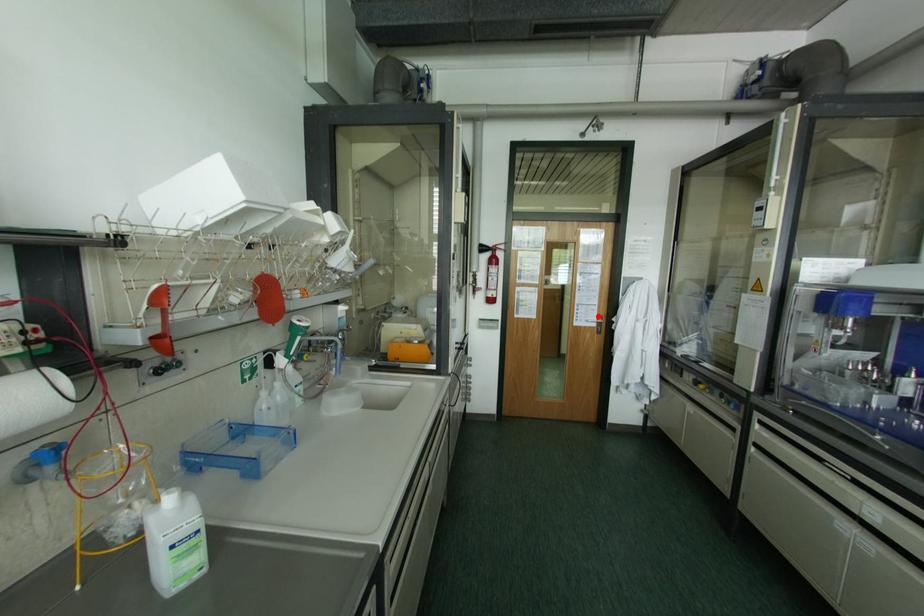
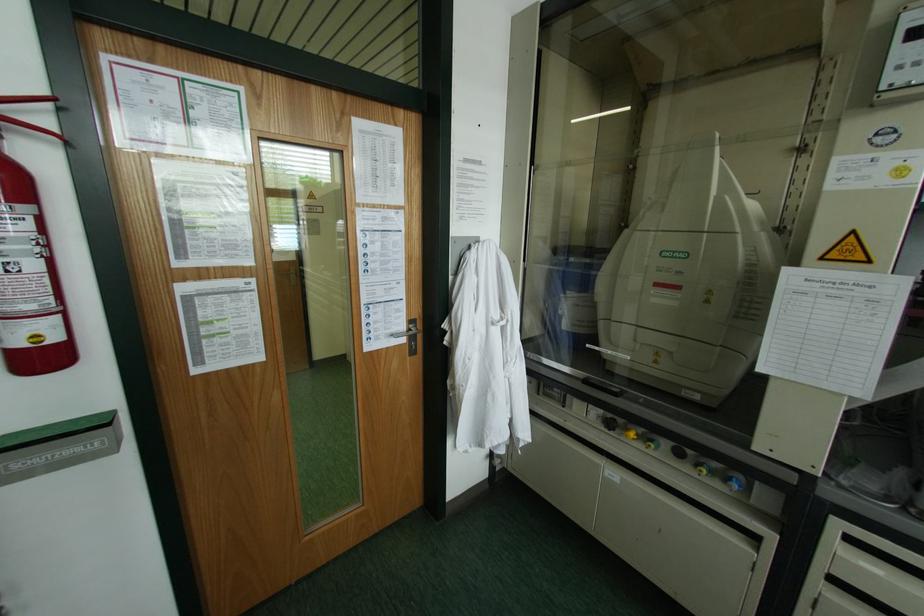
The point at the highlighted location is marked in the first image. Where is the corresponding point in the second image?

(409, 321)